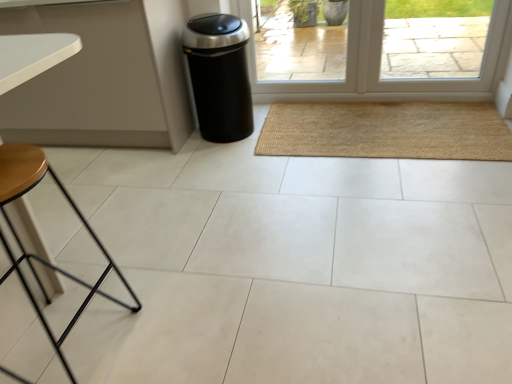
Question: From a real-world perspective, is black matte trash can at center-left physically below transparent glass door at center?

Choices:
 (A) yes
 (B) no

Answer: (A)

Question: Is black matte trash can at center-left placed right next to transparent glass door at center?

Choices:
 (A) no
 (B) yes

Answer: (A)

Question: Can you confirm if black matte trash can at center-left is taller than transparent glass door at center?

Choices:
 (A) no
 (B) yes

Answer: (B)

Question: Is black matte trash can at center-left looking in the opposite direction of transparent glass door at center?

Choices:
 (A) no
 (B) yes

Answer: (A)

Question: From a real-world perspective, is black matte trash can at center-left on top of transparent glass door at center?

Choices:
 (A) yes
 (B) no

Answer: (B)

Question: From a real-world perspective, is natural fiber mat at center positioned above or below transparent glass door at center?

Choices:
 (A) below
 (B) above

Answer: (A)

Question: Is point (359, 140) closer or farther from the camera than point (279, 41)?

Choices:
 (A) farther
 (B) closer

Answer: (B)

Question: In terms of height, does natural fiber mat at center look taller or shorter compared to transparent glass door at center?

Choices:
 (A) short
 (B) tall

Answer: (A)

Question: Visually, is natural fiber mat at center positioned to the left or to the right of transparent glass door at center?

Choices:
 (A) right
 (B) left

Answer: (A)

Question: Does point (24, 163) appear closer or farther from the camera than point (214, 120)?

Choices:
 (A) farther
 (B) closer

Answer: (B)

Question: Which is correct: wooden stool at lower left is inside black matte trash can at center-left, or outside of it?

Choices:
 (A) outside
 (B) inside

Answer: (A)

Question: Based on their positions, is wooden stool at lower left located to the left or right of black matte trash can at center-left?

Choices:
 (A) left
 (B) right

Answer: (A)

Question: From the image's perspective, relative to black matte trash can at center-left, is wooden stool at lower left above or below?

Choices:
 (A) above
 (B) below

Answer: (B)

Question: Visually, is black matte trash can at center-left positioned to the left or to the right of natural fiber mat at center?

Choices:
 (A) right
 (B) left

Answer: (B)

Question: Considering the positions of black matte trash can at center-left and natural fiber mat at center in the image, is black matte trash can at center-left bigger or smaller than natural fiber mat at center?

Choices:
 (A) small
 (B) big

Answer: (B)